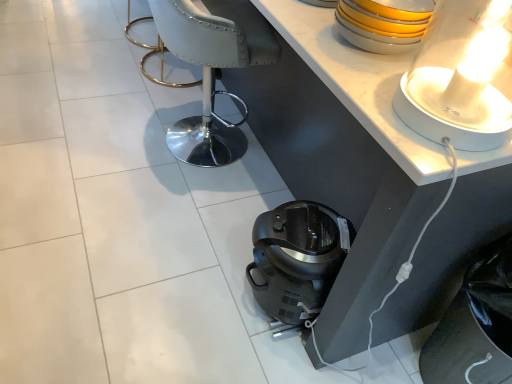
The width and height of the screenshot is (512, 384). I want to click on vacant space situated on the left part of white leather armchair at center, so click(109, 119).